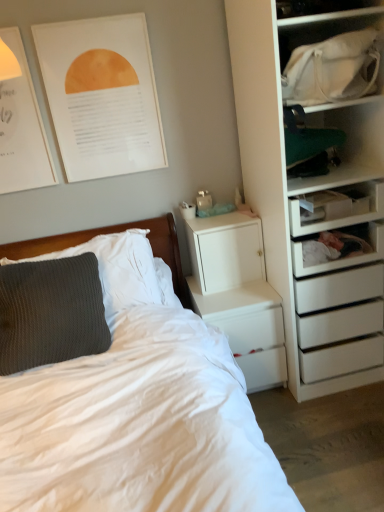
Where is `knitted gray pillow at left, the 2th pillow in the front-to-back sequence`? This screenshot has height=512, width=384. knitted gray pillow at left, the 2th pillow in the front-to-back sequence is located at coordinates (117, 269).

Describe the element at coordinates (139, 426) in the screenshot. Image resolution: width=384 pixels, height=512 pixels. I see `white soft bed at left` at that location.

The width and height of the screenshot is (384, 512). Describe the element at coordinates (331, 56) in the screenshot. I see `white fabric bag at upper right` at that location.

This screenshot has height=512, width=384. What are the coordinates of `matte paper poster at upper left, the first poster page when ordered from left to right` in the screenshot? It's located at (20, 122).

Identify the location of white paper poster at upper left, the first poster page in the right-to-left sequence. The height and width of the screenshot is (512, 384). (102, 95).

The width and height of the screenshot is (384, 512). What are the coordinates of `white glossy nightstand at lower center` in the screenshot? It's located at (238, 294).

Is white plastic drawer at right taller than white matte/file cabinet at upper right?

In fact, white plastic drawer at right may be shorter than white matte/file cabinet at upper right.

Considering the relative sizes of white plastic drawer at right and white matte/file cabinet at upper right in the image provided, is white plastic drawer at right thinner than white matte/file cabinet at upper right?

Incorrect, the width of white plastic drawer at right is not less than that of white matte/file cabinet at upper right.

Which point is more forward, (336, 225) or (263, 262)?

The point (336, 225) is closer.

Is white plastic drawer at right in front of or behind white matte/file cabinet at upper right in the image?

In the image, white plastic drawer at right appears in front of white matte/file cabinet at upper right.

Is point (103, 126) positioned behind point (334, 214)?

Yes, point (103, 126) is behind point (334, 214).

Is white paper poster at upper left, the 2th poster page when ordered from left to right, in contact with white plastic drawer at right?

white paper poster at upper left, the 2th poster page when ordered from left to right, and white plastic drawer at right are not in contact.

From their relative heights in the image, would you say white paper poster at upper left, the 2th poster page when ordered from left to right, is taller or shorter than white plastic drawer at right?

In the image, white paper poster at upper left, the 2th poster page when ordered from left to right, appears to be taller than white plastic drawer at right.

From the image's perspective, is white paper poster at upper left, the first poster page in the right-to-left sequence, located above or below white plastic drawer at right?

Based on their image positions, white paper poster at upper left, the first poster page in the right-to-left sequence, is located above white plastic drawer at right.

How many degrees apart are the facing directions of matte paper poster at upper left, the first poster page when ordered from left to right, and white plastic drawer at right?

0.424 degrees.

Is matte paper poster at upper left, the first poster page when ordered from left to right, wider or thinner than white plastic drawer at right?

matte paper poster at upper left, the first poster page when ordered from left to right, is thinner than white plastic drawer at right.

Is matte paper poster at upper left, the first poster page when ordered from left to right, positioned with its back to white plastic drawer at right?

matte paper poster at upper left, the first poster page when ordered from left to right, does not have its back to white plastic drawer at right.

Is matte paper poster at upper left, the first poster page when ordered from left to right, spatially inside white plastic drawer at right, or outside of it?

matte paper poster at upper left, the first poster page when ordered from left to right, is spatially situated outside white plastic drawer at right.

Consider the image. Which is correct: white fabric bag at upper right is inside knitted gray pillow at left, the 1th pillow positioned from the front, or outside of it?

white fabric bag at upper right lies outside knitted gray pillow at left, the 1th pillow positioned from the front.

Can you confirm if white fabric bag at upper right is thinner than knitted gray pillow at left, the 1th pillow positioned from the front?

Correct, the width of white fabric bag at upper right is less than that of knitted gray pillow at left, the 1th pillow positioned from the front.

Is white fabric bag at upper right to the left or to the right of knitted gray pillow at left, the 1th pillow positioned from the front, in the image?

In the image, white fabric bag at upper right appears on the right side of knitted gray pillow at left, the 1th pillow positioned from the front.

Which point is more distant from viewer, (303, 80) or (75, 277)?

The point (75, 277) is more distant.

Between point (245, 279) and point (374, 210), which one is positioned behind?

The point (245, 279) is farther from the camera.

From a real-world perspective, between white matte/file cabinet at upper right and white plastic drawer at right, who is vertically lower?

white matte/file cabinet at upper right.

Considering the relative positions of white matte/file cabinet at upper right and white plastic drawer at right in the image provided, is white matte/file cabinet at upper right to the left of white plastic drawer at right from the viewer's perspective?

Correct, you'll find white matte/file cabinet at upper right to the left of white plastic drawer at right.

Is white matte/file cabinet at upper right outside of white plastic drawer at right?

white matte/file cabinet at upper right lies outside white plastic drawer at right's area.

Locate an element on the screen. cabinet on the right of white paper poster at upper left, the first poster page in the right-to-left sequence is located at coordinates (331, 56).

Considering the positions of objects white fabric bag at upper right and white paper poster at upper left, the first poster page in the right-to-left sequence, in the image provided, who is behind, white fabric bag at upper right or white paper poster at upper left, the first poster page in the right-to-left sequence,?

white paper poster at upper left, the first poster page in the right-to-left sequence.

Can white paper poster at upper left, the first poster page in the right-to-left sequence, be found inside white fabric bag at upper right?

No, white paper poster at upper left, the first poster page in the right-to-left sequence, is not inside white fabric bag at upper right.

From the image's perspective, between white fabric bag at upper right and white paper poster at upper left, the 2th poster page when ordered from left to right, who is located below?

white fabric bag at upper right is shown below in the image.

What's the angular difference between white fabric bag at upper right and white glossy nightstand at lower center's facing directions?

0.886 degrees.

Is white fabric bag at upper right spatially inside white glossy nightstand at lower center, or outside of it?

The correct answer is: outside.

Considering the sizes of objects white fabric bag at upper right and white glossy nightstand at lower center in the image provided, who is taller, white fabric bag at upper right or white glossy nightstand at lower center?

white glossy nightstand at lower center.

From the image's perspective, is white fabric bag at upper right below white glossy nightstand at lower center?

Incorrect, from the image's perspective, white fabric bag at upper right is higher than white glossy nightstand at lower center.

This screenshot has width=384, height=512. What are the coordinates of `file cabinet below the white plastic drawer at right (from a real-world perspective)` in the screenshot? It's located at (225, 251).

The image size is (384, 512). What are the coordinates of `shelf that is below the white paper poster at upper left, the 2th poster page when ordered from left to right (from the image's perspective)` in the screenshot? It's located at 336,207.

Based on their spatial positions, is white matte/file cabinet at upper right or knitted gray pillow at left, the 1th pillow positioned from the back, closer to white soft bed at left?

The object closer to white soft bed at left is knitted gray pillow at left, the 1th pillow positioned from the back.

Based on their spatial positions, is white glossy nightstand at lower center or white matte/file cabinet at upper right closer to white soft bed at left?

white glossy nightstand at lower center is closer to white soft bed at left.

Which object lies nearer to the anchor point white soft bed at left, white fabric bag at upper right or matte paper poster at upper left, which is the 2th poster page from right to left?

matte paper poster at upper left, which is the 2th poster page from right to left, is closer to white soft bed at left.

When comparing their distances from matte paper poster at upper left, the first poster page when ordered from left to right, does white fabric bag at upper right or white soft bed at left seem closer?

white soft bed at left lies closer to matte paper poster at upper left, the first poster page when ordered from left to right, than the other object.

Considering their positions, is white glossy nightstand at lower center positioned closer to knitted gray pillow at left, the 1th pillow positioned from the front, than white paper poster at upper left, the 2th poster page when ordered from left to right?

white glossy nightstand at lower center lies closer to knitted gray pillow at left, the 1th pillow positioned from the front, than the other object.

Based on their spatial positions, is white soft bed at left or white paper poster at upper left, the 2th poster page when ordered from left to right, closer to white matte/file cabinet at upper right?

Result: The object closer to white matte/file cabinet at upper right is white soft bed at left.

Based on their spatial positions, is knitted gray pillow at left, the 1th pillow positioned from the front, or white fabric bag at upper right further from matte paper poster at upper left, the first poster page when ordered from left to right?

white fabric bag at upper right is positioned further to the anchor matte paper poster at upper left, the first poster page when ordered from left to right.

Based on their spatial positions, is white fabric bag at upper right or white soft bed at left further from white plastic drawer at right?

Based on the image, white soft bed at left appears to be further to white plastic drawer at right.

This screenshot has width=384, height=512. I want to click on file cabinet situated between white paper poster at upper left, the 2th poster page when ordered from left to right, and white plastic drawer at right from left to right, so click(x=225, y=251).

Locate an element on the screen. This screenshot has width=384, height=512. file cabinet situated between matte paper poster at upper left, which is the 2th poster page from right to left, and white fabric bag at upper right from left to right is located at coordinates (225, 251).

Locate an element on the screen. The height and width of the screenshot is (512, 384). poster page that lies between white paper poster at upper left, the first poster page in the right-to-left sequence, and knitted gray pillow at left, the 2th pillow in the back-to-front sequence, from top to bottom is located at coordinates (20, 122).

Locate an element on the screen. Image resolution: width=384 pixels, height=512 pixels. file cabinet between white paper poster at upper left, the first poster page in the right-to-left sequence, and white glossy nightstand at lower center in the up-down direction is located at coordinates (225, 251).